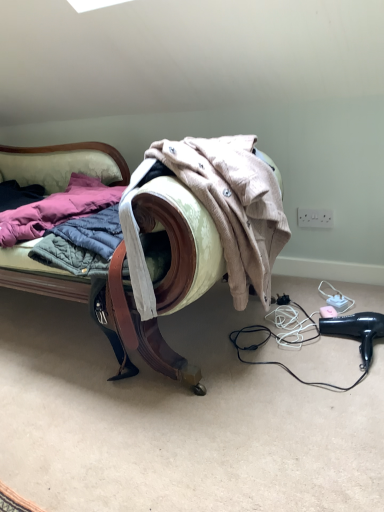
The width and height of the screenshot is (384, 512). Find the location of `vacant space underneath black plastic hair dryer at lower right (from a real-world perspective)`. vacant space underneath black plastic hair dryer at lower right (from a real-world perspective) is located at coordinates (357, 345).